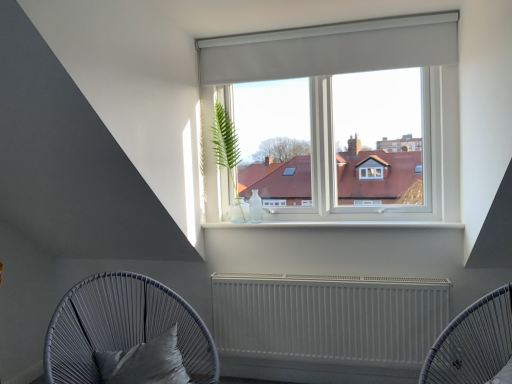
The image size is (512, 384). What do you see at coordinates (122, 327) in the screenshot?
I see `matte grey wicker chair with cushion at lower left, the first furniture from the left` at bounding box center [122, 327].

The image size is (512, 384). Describe the element at coordinates (225, 143) in the screenshot. I see `green leafy plant in glass vase at upper left` at that location.

The height and width of the screenshot is (384, 512). Describe the element at coordinates (329, 317) in the screenshot. I see `white matte radiator at center` at that location.

Locate an element on the screen. The width and height of the screenshot is (512, 384). white matte radiator at lower center, positioned as the 1th furniture in right-to-left order is located at coordinates (474, 344).

Is green leafy plant in glass vase at upper left to the left of white matte radiator at lower center, arranged as the 2th furniture when viewed from the left, from the viewer's perspective?

Correct, you'll find green leafy plant in glass vase at upper left to the left of white matte radiator at lower center, arranged as the 2th furniture when viewed from the left.

In terms of width, does green leafy plant in glass vase at upper left look wider or thinner when compared to white matte radiator at lower center, positioned as the 1th furniture in right-to-left order?

green leafy plant in glass vase at upper left is thinner than white matte radiator at lower center, positioned as the 1th furniture in right-to-left order.

Is green leafy plant in glass vase at upper left not close to white matte radiator at center?

green leafy plant in glass vase at upper left is near white matte radiator at center, not far away.

In the scene shown: Is green leafy plant in glass vase at upper left bigger or smaller than white matte radiator at center?

Clearly, green leafy plant in glass vase at upper left is smaller in size than white matte radiator at center.

Is green leafy plant in glass vase at upper left in front of or behind white matte radiator at center in the image?

Clearly, green leafy plant in glass vase at upper left is behind white matte radiator at center.

Can you tell me how much white matte radiator at lower center, positioned as the 1th furniture in right-to-left order, and satin black pillow at lower left differ in facing direction?

The angle between the facing direction of white matte radiator at lower center, positioned as the 1th furniture in right-to-left order, and the facing direction of satin black pillow at lower left is 76.1 degrees.

From a real-world perspective, is white matte radiator at lower center, arranged as the 2th furniture when viewed from the left, located higher than satin black pillow at lower left?

Yes, from a real-world perspective, white matte radiator at lower center, arranged as the 2th furniture when viewed from the left, is above satin black pillow at lower left.

Is white matte radiator at lower center, positioned as the 1th furniture in right-to-left order, smaller than satin black pillow at lower left?

Actually, white matte radiator at lower center, positioned as the 1th furniture in right-to-left order, might be larger than satin black pillow at lower left.

Visually, is white matte radiator at lower center, positioned as the 1th furniture in right-to-left order, positioned to the left or to the right of satin black pillow at lower left?

Clearly, white matte radiator at lower center, positioned as the 1th furniture in right-to-left order, is on the right of satin black pillow at lower left in the image.

Between point (148, 382) and point (233, 150), which one is positioned behind?

The point (233, 150) is behind.

Is satin black pillow at lower left far from green leafy plant in glass vase at upper left?

Indeed, satin black pillow at lower left is not near green leafy plant in glass vase at upper left.

You are a GUI agent. You are given a task and a screenshot of the screen. Output one action in this format:
    pyautogui.click(x=<x>, y=<y>)
    Task: Click on the pillow located underneath the green leafy plant in glass vase at upper left (from a real-world perspective)
    
    Given the screenshot: What is the action you would take?
    pyautogui.click(x=144, y=362)

Which of these two, satin black pillow at lower left or green leafy plant in glass vase at upper left, stands shorter?

satin black pillow at lower left is shorter.

In terms of size, does satin black pillow at lower left appear bigger or smaller than white matte radiator at lower center, arranged as the 2th furniture when viewed from the left?

Considering their sizes, satin black pillow at lower left takes up less space than white matte radiator at lower center, arranged as the 2th furniture when viewed from the left.

Is satin black pillow at lower left not close to white matte radiator at lower center, arranged as the 2th furniture when viewed from the left?

Yes, satin black pillow at lower left and white matte radiator at lower center, arranged as the 2th furniture when viewed from the left, are located far from each other.

From a real-world perspective, is satin black pillow at lower left beneath white matte radiator at lower center, arranged as the 2th furniture when viewed from the left?

Yes, from a real-world perspective, satin black pillow at lower left is under white matte radiator at lower center, arranged as the 2th furniture when viewed from the left.

Which of these two, satin black pillow at lower left or white matte radiator at lower center, arranged as the 2th furniture when viewed from the left, is wider?

With larger width is white matte radiator at lower center, arranged as the 2th furniture when viewed from the left.

Does point (433, 286) come closer to viewer compared to point (118, 372)?

No.

Considering the positions of objects white matte radiator at center and satin black pillow at lower left in the image provided, who is in front, white matte radiator at center or satin black pillow at lower left?

satin black pillow at lower left is closer to the camera.

Are white matte radiator at center and satin black pillow at lower left making contact?

They are not placed beside each other.

Is white matte radiator at center wider or thinner than satin black pillow at lower left?

Considering their sizes, white matte radiator at center looks slimmer than satin black pillow at lower left.

From the image's perspective, which is above, green leafy plant in glass vase at upper left or matte grey wicker chair with cushion at lower left, the first furniture from the left?

green leafy plant in glass vase at upper left.

From a real-world perspective, is green leafy plant in glass vase at upper left physically above matte grey wicker chair with cushion at lower left, the first furniture from the left?

Correct, in the physical world, green leafy plant in glass vase at upper left is higher than matte grey wicker chair with cushion at lower left, the first furniture from the left.

Visually, is green leafy plant in glass vase at upper left positioned to the left or to the right of matte grey wicker chair with cushion at lower left, acting as the 2th furniture starting from the right?

From the image, it's evident that green leafy plant in glass vase at upper left is to the right of matte grey wicker chair with cushion at lower left, acting as the 2th furniture starting from the right.

Is green leafy plant in glass vase at upper left shorter than matte grey wicker chair with cushion at lower left, the first furniture from the left?

No, green leafy plant in glass vase at upper left is not shorter than matte grey wicker chair with cushion at lower left, the first furniture from the left.

Where is `plant on the left of the white matte radiator at lower center, positioned as the 1th furniture in right-to-left order`? The width and height of the screenshot is (512, 384). plant on the left of the white matte radiator at lower center, positioned as the 1th furniture in right-to-left order is located at coordinates (225, 143).

Identify the location of plant above the white matte radiator at center (from a real-world perspective). This screenshot has height=384, width=512. (225, 143).

Considering their positions, is matte grey wicker chair with cushion at lower left, the first furniture from the left, positioned further to green leafy plant in glass vase at upper left than white matte radiator at lower center, positioned as the 1th furniture in right-to-left order?

white matte radiator at lower center, positioned as the 1th furniture in right-to-left order, lies further to green leafy plant in glass vase at upper left than the other object.

Which object lies further to the anchor point satin black pillow at lower left, white matte radiator at center or green leafy plant in glass vase at upper left?

green leafy plant in glass vase at upper left lies further to satin black pillow at lower left than the other object.

From the image, which object appears to be nearer to green leafy plant in glass vase at upper left, satin black pillow at lower left or white matte radiator at lower center, arranged as the 2th furniture when viewed from the left?

satin black pillow at lower left is positioned closer to the anchor green leafy plant in glass vase at upper left.

Considering their positions, is white matte radiator at lower center, arranged as the 2th furniture when viewed from the left, positioned closer to green leafy plant in glass vase at upper left than matte grey wicker chair with cushion at lower left, acting as the 2th furniture starting from the right?

matte grey wicker chair with cushion at lower left, acting as the 2th furniture starting from the right, is positioned closer to the anchor green leafy plant in glass vase at upper left.

From the image, which object appears to be farther from green leafy plant in glass vase at upper left, white matte radiator at center or matte grey wicker chair with cushion at lower left, acting as the 2th furniture starting from the right?

Among the two, matte grey wicker chair with cushion at lower left, acting as the 2th furniture starting from the right, is located further to green leafy plant in glass vase at upper left.

Considering their positions, is satin black pillow at lower left positioned further to white matte radiator at lower center, positioned as the 1th furniture in right-to-left order, than matte grey wicker chair with cushion at lower left, the first furniture from the left?

matte grey wicker chair with cushion at lower left, the first furniture from the left.

Based on their spatial positions, is white matte radiator at lower center, positioned as the 1th furniture in right-to-left order, or satin black pillow at lower left closer to green leafy plant in glass vase at upper left?

satin black pillow at lower left is positioned closer to the anchor green leafy plant in glass vase at upper left.

Considering their positions, is white matte radiator at center positioned further to green leafy plant in glass vase at upper left than satin black pillow at lower left?

satin black pillow at lower left lies further to green leafy plant in glass vase at upper left than the other object.

This screenshot has width=512, height=384. I want to click on plant situated between matte grey wicker chair with cushion at lower left, the first furniture from the left, and white matte radiator at lower center, positioned as the 1th furniture in right-to-left order, from left to right, so click(x=225, y=143).

I want to click on radiator between matte grey wicker chair with cushion at lower left, acting as the 2th furniture starting from the right, and white matte radiator at lower center, positioned as the 1th furniture in right-to-left order, from left to right, so click(x=329, y=317).

Where is `radiator between white matte radiator at lower center, arranged as the 2th furniture when viewed from the left, and green leafy plant in glass vase at upper left from front to back`? The width and height of the screenshot is (512, 384). radiator between white matte radiator at lower center, arranged as the 2th furniture when viewed from the left, and green leafy plant in glass vase at upper left from front to back is located at coordinates (329, 317).

Locate an element on the screen. Image resolution: width=512 pixels, height=384 pixels. pillow between matte grey wicker chair with cushion at lower left, the first furniture from the left, and white matte radiator at lower center, positioned as the 1th furniture in right-to-left order, from left to right is located at coordinates (144, 362).